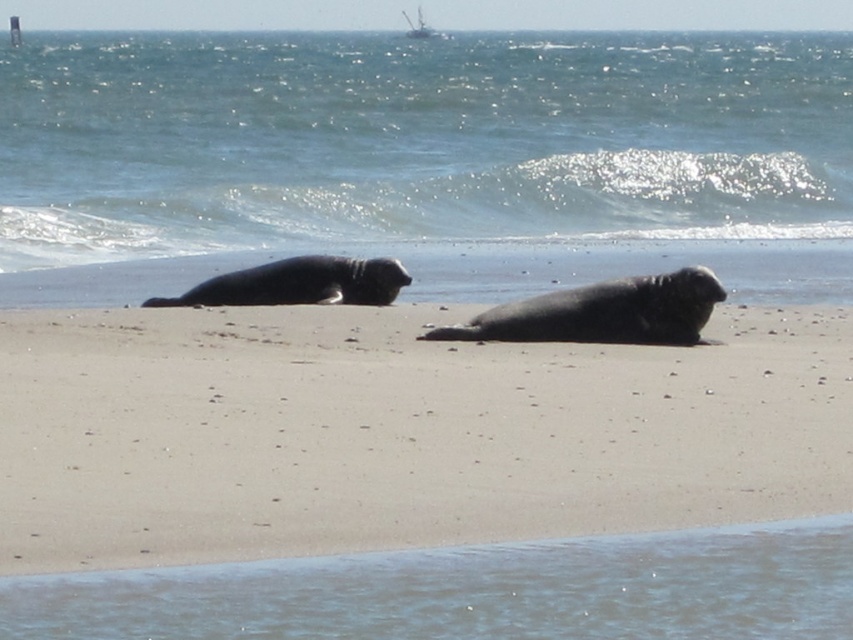
Question: Is smooth sand at center bigger than gray fur seal at center?

Choices:
 (A) yes
 (B) no

Answer: (B)

Question: Can you confirm if smooth sand at center is positioned to the left of gray fur seal at center?

Choices:
 (A) no
 (B) yes

Answer: (B)

Question: Does smooth sand at center have a larger size compared to blue water at upper center?

Choices:
 (A) yes
 (B) no

Answer: (B)

Question: Which point appears farthest from the camera in this image?

Choices:
 (A) (287, 136)
 (B) (605, 328)

Answer: (A)

Question: Which point appears farthest from the camera in this image?

Choices:
 (A) (94, 164)
 (B) (561, 332)

Answer: (A)

Question: Which of the following is the closest to the observer?

Choices:
 (A) [x=521, y=220]
 (B) [x=642, y=525]
 (C) [x=434, y=332]

Answer: (B)